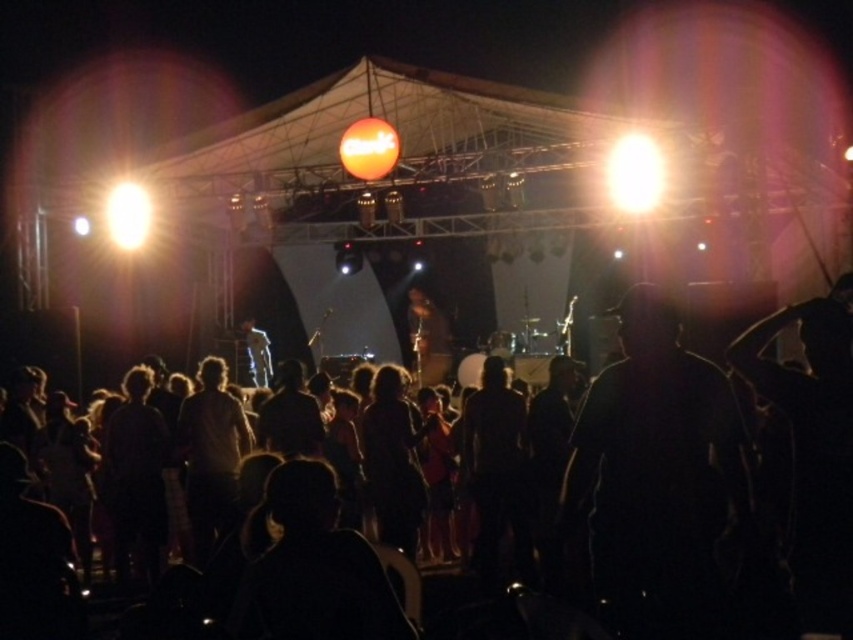
Can you confirm if black matte person at center is taller than matte black microphone at center?

Yes.

In the scene shown: Does black matte person at center appear under matte black microphone at center?

Yes, black matte person at center is below matte black microphone at center.

Describe the element at coordinates (813, 461) in the screenshot. I see `black matte person at center` at that location.

This screenshot has height=640, width=853. I want to click on black matte person at center, so click(813, 461).

Is bright white light at upper right smaller than orange matte sign at center?

No.

The image size is (853, 640). Describe the element at coordinates (634, 173) in the screenshot. I see `bright white light at upper right` at that location.

Image resolution: width=853 pixels, height=640 pixels. I want to click on bright white light at upper right, so click(634, 173).

Which of these two, bright white light at upper right or matte black microphone at center, stands taller?

matte black microphone at center

Which is more to the left, bright white light at upper right or matte black microphone at center?

matte black microphone at center

Is point (660, 160) in front of point (428, 342)?

Yes, point (660, 160) is closer to viewer.

The image size is (853, 640). I want to click on bright white light at upper right, so click(x=634, y=173).